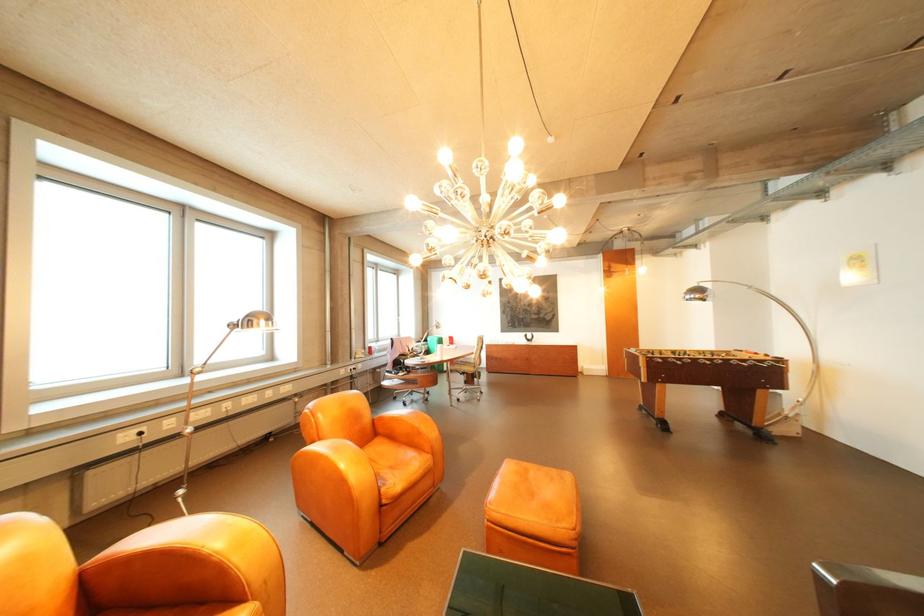
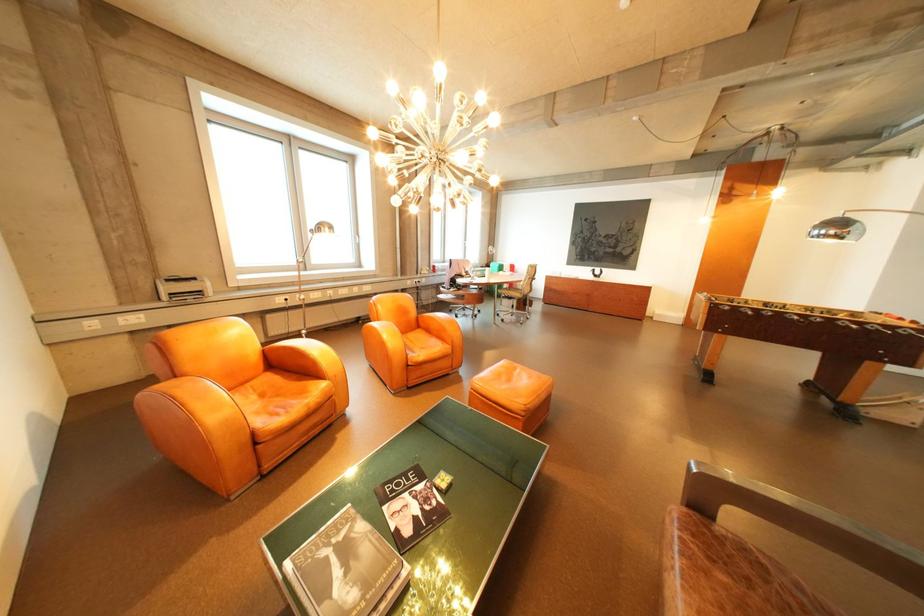
Find the pixel in the second image that matches point (708, 361) in the first image.

(794, 314)